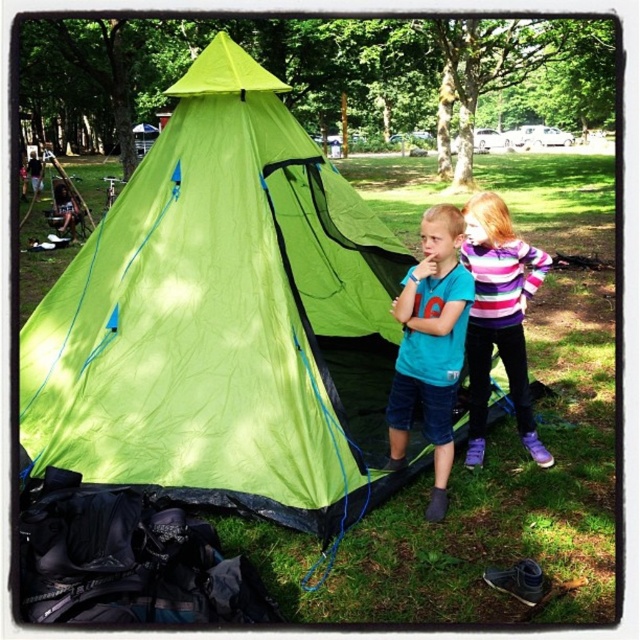
Based on the photo, you are a photographer standing in front of the bright green tent with blue accents. You want to take a photo that includes both the point at coordinates point [106,266] and the point at coordinates point [509,252]. Which point should you focus on first to ensure both are in the frame?

You should focus on point [106,266] first because it is closer to you than point [509,252], ensuring both points are within the camera frame.

You are a camper who wants to know if the green fabric tent at center can accommodate both the teal matte shirt at center and another similar item. Based on their sizes, can the tent hold both items inside?

The green fabric tent at center is larger in size compared to the teal matte shirt at center, so it can accommodate both the teal matte shirt at center and another similar item inside.

You are a hiker who wants to know which item is bigger between the green fabric tent at center and the striped sweater at center. Which one is larger?

The green fabric tent at center is larger than the striped sweater at center.